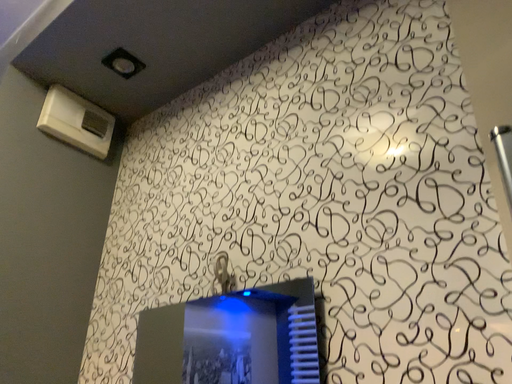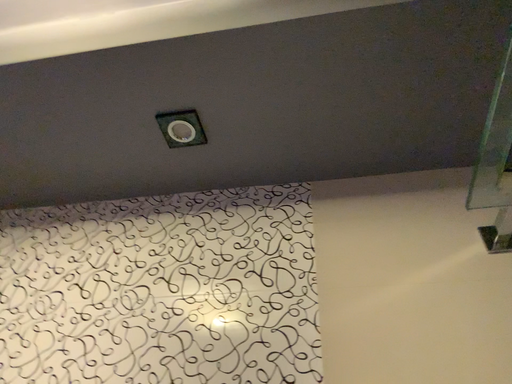
Question: How did the camera likely rotate when shooting the video?

Choices:
 (A) rotated right
 (B) rotated left

Answer: (A)